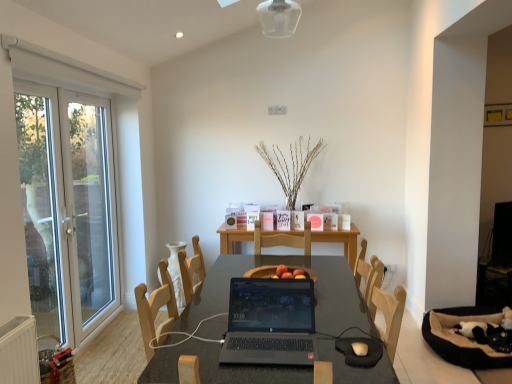
Image resolution: width=512 pixels, height=384 pixels. What are the coordinates of `free space to the left of matte white mouse at center` in the screenshot? It's located at [320, 354].